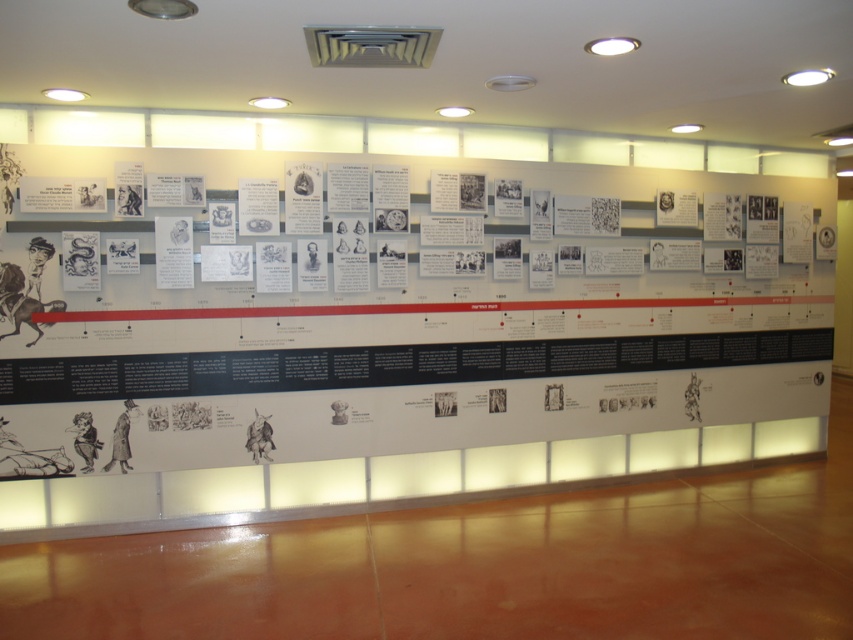
Question: Does white paper poster at center have a larger size compared to white paper poster at left?

Choices:
 (A) no
 (B) yes

Answer: (B)

Question: Which point is farther from the camera taking this photo?

Choices:
 (A) (587, 248)
 (B) (62, 182)

Answer: (A)

Question: Is white paper poster at center thinner than white paper poster at left?

Choices:
 (A) no
 (B) yes

Answer: (A)

Question: Is white paper poster at center smaller than white paper poster at left?

Choices:
 (A) no
 (B) yes

Answer: (A)

Question: Which point appears closest to the camera in this image?

Choices:
 (A) (91, 196)
 (B) (675, 282)

Answer: (A)